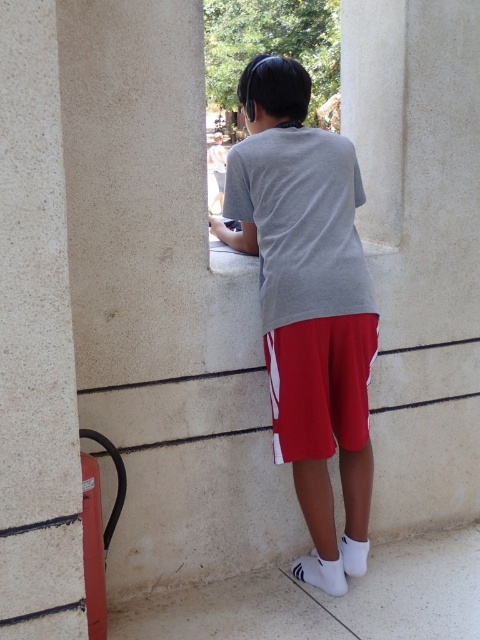
Looking at this image, is gray matte t-shirt at center wider than white textured pillar at left?

Correct, the width of gray matte t-shirt at center exceeds that of white textured pillar at left.

Between gray matte t-shirt at center and white textured pillar at left, which one is positioned lower?

white textured pillar at left is below.

At what (x,y) coordinates should I click in order to perform the action: click on gray matte t-shirt at center. Please return your answer as a coordinate pair (x, y). The width and height of the screenshot is (480, 640). Looking at the image, I should click on (308, 305).

The width and height of the screenshot is (480, 640). In order to click on gray matte t-shirt at center in this screenshot , I will do `click(308, 305)`.

Which is behind, point (15, 244) or point (334, 378)?

The point (334, 378) is behind.

Image resolution: width=480 pixels, height=640 pixels. What do you see at coordinates (36, 342) in the screenshot? I see `white textured pillar at left` at bounding box center [36, 342].

This screenshot has width=480, height=640. What are the coordinates of `white textured pillar at left` in the screenshot? It's located at (36, 342).

Between point (367, 52) and point (332, 250), which one is positioned in front?

Point (332, 250) is in front.

Which is in front, point (430, 77) or point (276, 416)?

Positioned in front is point (276, 416).

I want to click on white smooth pillar at center, so click(420, 248).